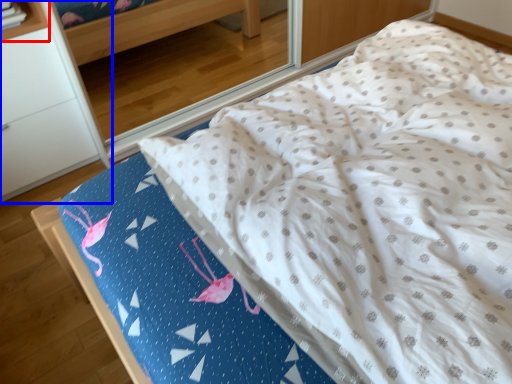
Question: Which object appears farthest to the camera in this image, shelf (highlighted by a red box) or furniture (highlighted by a blue box)?

Choices:
 (A) shelf
 (B) furniture

Answer: (A)